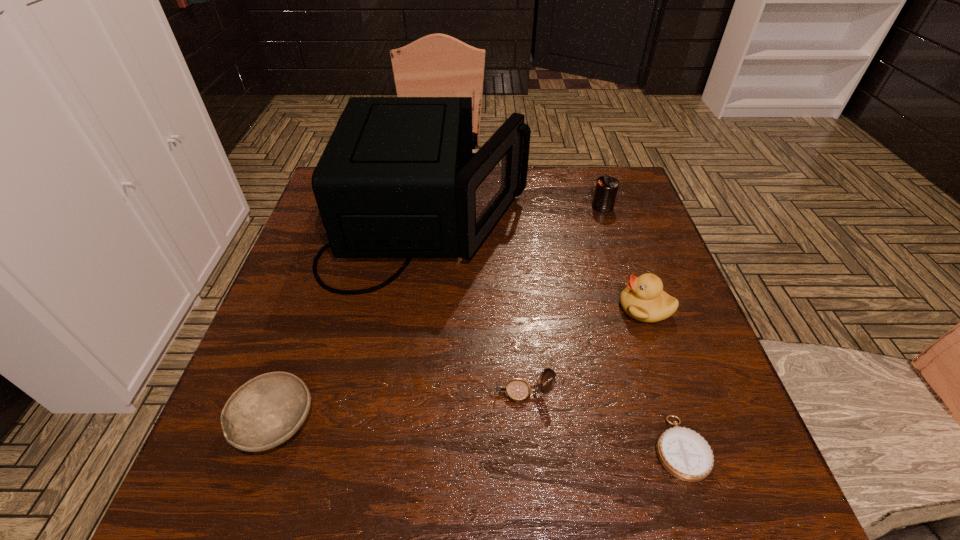
Locate an element on the screen. Image resolution: width=960 pixels, height=540 pixels. object that is at the near right corner is located at coordinates (685, 454).

In the image, there is a desktop. Identify the location of vacant space at the far edge. This screenshot has width=960, height=540. (576, 183).

Find the location of `vacant area at the near edge of the desktop`. vacant area at the near edge of the desktop is located at coordinates (396, 500).

I want to click on vacant space at the left edge of the desktop, so click(332, 299).

Find the location of a particular element. This screenshot has width=960, height=540. vacant space at the right edge of the desktop is located at coordinates (675, 388).

Locate an element on the screen. free space at the near left corner is located at coordinates (276, 456).

In the image, there is a desktop. Where is `vacant space at the near right corner`? The image size is (960, 540). vacant space at the near right corner is located at coordinates (771, 498).

Locate an element on the screen. The width and height of the screenshot is (960, 540). unoccupied position between the microwave oven and the taller compass is located at coordinates (475, 307).

I want to click on empty location between the microwave oven and the can, so click(x=516, y=214).

Identify the location of free space between the microwave oven and the bowl. (352, 322).